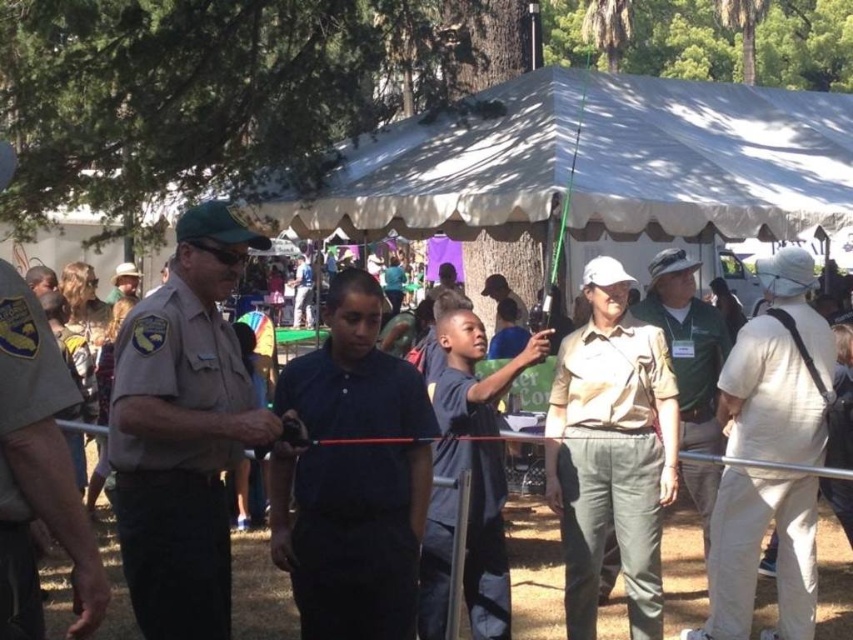
Does khaki uniform at center have a larger size compared to matte khaki uniform at center?

Yes.

Between point (689, 488) and point (309, 275), which one is positioned behind?

The point (309, 275) is behind.

The width and height of the screenshot is (853, 640). What are the coordinates of `khaki uniform at center` in the screenshot? It's located at (688, 344).

The width and height of the screenshot is (853, 640). What are the coordinates of `khaki uniform at center` in the screenshot? It's located at (688, 344).

Who is more distant from viewer, (x=833, y=356) or (x=306, y=259)?

Positioned behind is point (x=306, y=259).

Between point (807, 621) and point (294, 326), which one is positioned in front?

Point (807, 621)

Locate an element on the screen. The image size is (853, 640). beige cotton shirt at right is located at coordinates (779, 371).

Between tan uniform at center and brown uniform shirt at center, which one appears on the right side from the viewer's perspective?

Positioned to the right is brown uniform shirt at center.

Is point (575, 365) closer to camera compared to point (265, 560)?

Yes.

You are a GUI agent. You are given a task and a screenshot of the screen. Output one action in this format:
    pyautogui.click(x=<x>, y=<y>)
    Task: Click on the tan uniform at center
    This screenshot has width=853, height=640.
    Given the screenshot: What is the action you would take?
    pyautogui.click(x=611, y=452)